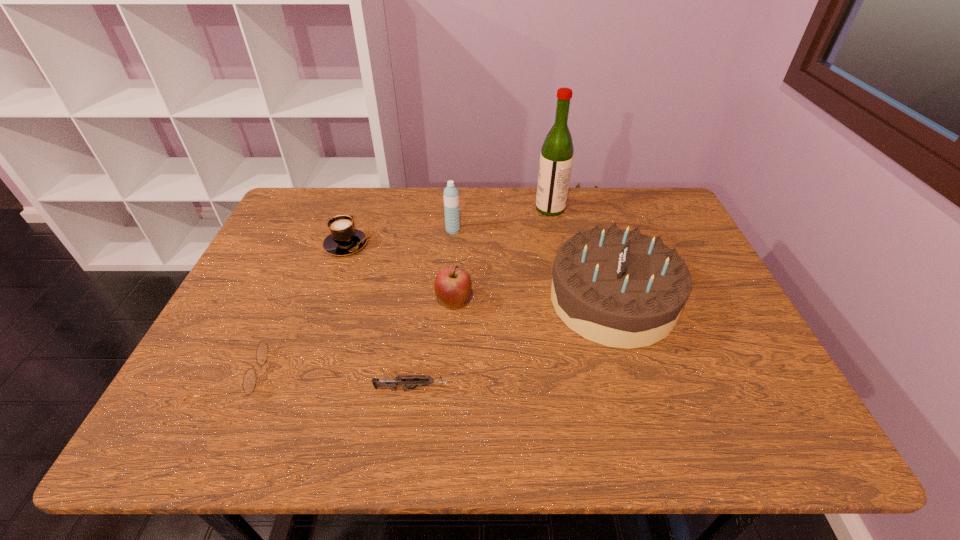
The width and height of the screenshot is (960, 540). In order to click on vacant region located 0.080m on the label of the liquor in this screenshot , I will do `click(511, 208)`.

I want to click on blank space located 0.400m on the label of the liquor, so click(x=412, y=208).

The height and width of the screenshot is (540, 960). Find the location of `vacant space located on the left of the water bottle`. vacant space located on the left of the water bottle is located at coordinates (334, 230).

Where is `free region located 0.140m on the front-facing side of the birthday cake`? free region located 0.140m on the front-facing side of the birthday cake is located at coordinates (494, 300).

This screenshot has width=960, height=540. I want to click on vacant position located on the front-facing side of the birthday cake, so click(x=483, y=300).

Locate an element on the screen. This screenshot has width=960, height=540. vacant area situated 0.220m on the front-facing side of the birthday cake is located at coordinates (464, 300).

You are a GUI agent. You are given a task and a screenshot of the screen. Output one action in this format:
    pyautogui.click(x=<x>, y=<y>)
    Task: Click on the vacant space situated 0.270m on the front of the apple
    
    Given the screenshot: What is the action you would take?
    pyautogui.click(x=447, y=415)

The width and height of the screenshot is (960, 540). Find the location of `blank area located on the right of the third shortest object`. blank area located on the right of the third shortest object is located at coordinates (458, 244).

This screenshot has width=960, height=540. I want to click on vacant space located on the temples of the spectacles, so (x=406, y=375).

I want to click on vacant area situated aimed along the barrel of the gun, so point(605,390).